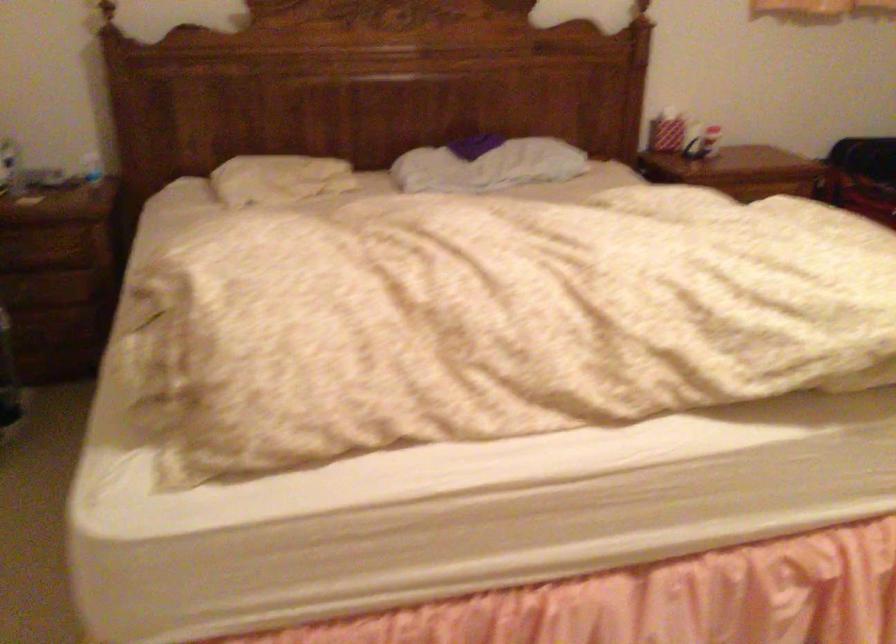
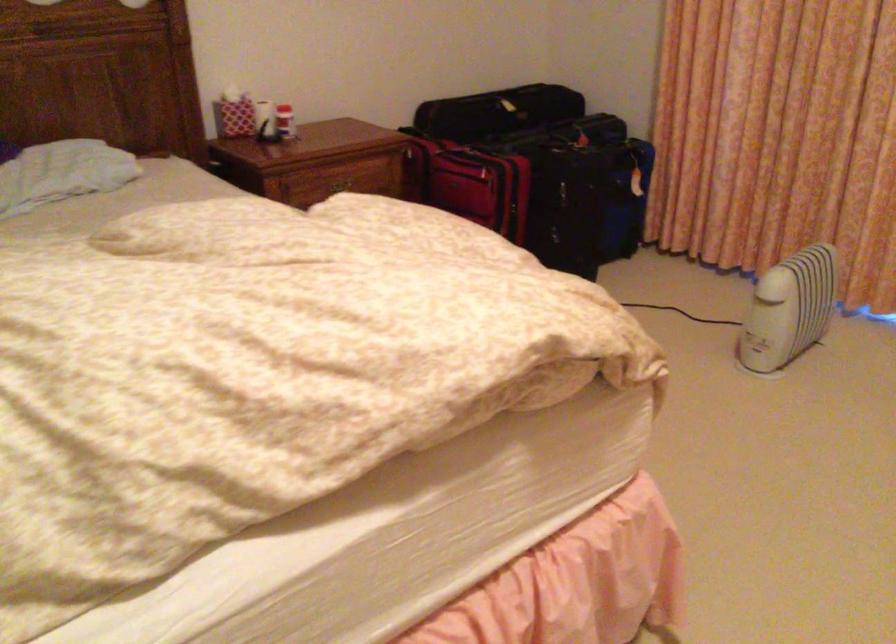
Which direction would the cameraman need to move to produce the second image?

The cameraman walked toward right, forward.